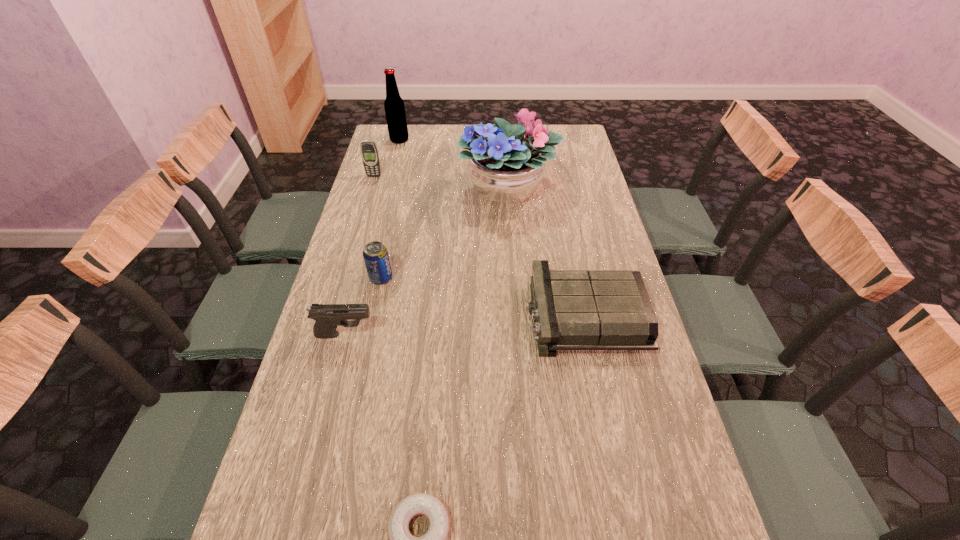
Where is `radio receiver present at the right edge`? Image resolution: width=960 pixels, height=540 pixels. radio receiver present at the right edge is located at coordinates (573, 310).

The image size is (960, 540). In order to click on object that is at the far left corner in this screenshot , I will do `click(394, 105)`.

In the image, there is a desktop. Identify the location of free space at the far edge. Image resolution: width=960 pixels, height=540 pixels. (425, 133).

This screenshot has height=540, width=960. What are the coordinates of `free space at the left edge of the desktop` in the screenshot? It's located at (323, 501).

Where is `free space at the right edge of the desktop`? free space at the right edge of the desktop is located at coordinates (651, 490).

This screenshot has height=540, width=960. Find the location of `vacant space at the far left corner`. vacant space at the far left corner is located at coordinates (378, 141).

You are a GUI agent. You are given a task and a screenshot of the screen. Output one action in this format:
    pyautogui.click(x=<x>, y=<y>)
    Task: Click on the vacant area that lies between the soda and the beer bottle
    Image resolution: width=960 pixels, height=540 pixels.
    Given the screenshot: What is the action you would take?
    pyautogui.click(x=390, y=209)

This screenshot has height=540, width=960. I want to click on free space between the soda and the beer bottle, so click(x=390, y=209).

This screenshot has height=540, width=960. Identify the location of vacant space that's between the pistol and the bouquet. (426, 262).

You are a GUI agent. You are given a task and a screenshot of the screen. Output one action in this format:
    pyautogui.click(x=<x>, y=<y>)
    Task: Click on the free area in between the bouquet and the cellular telephone
    The image size is (960, 540).
    Given the screenshot: What is the action you would take?
    pyautogui.click(x=441, y=183)